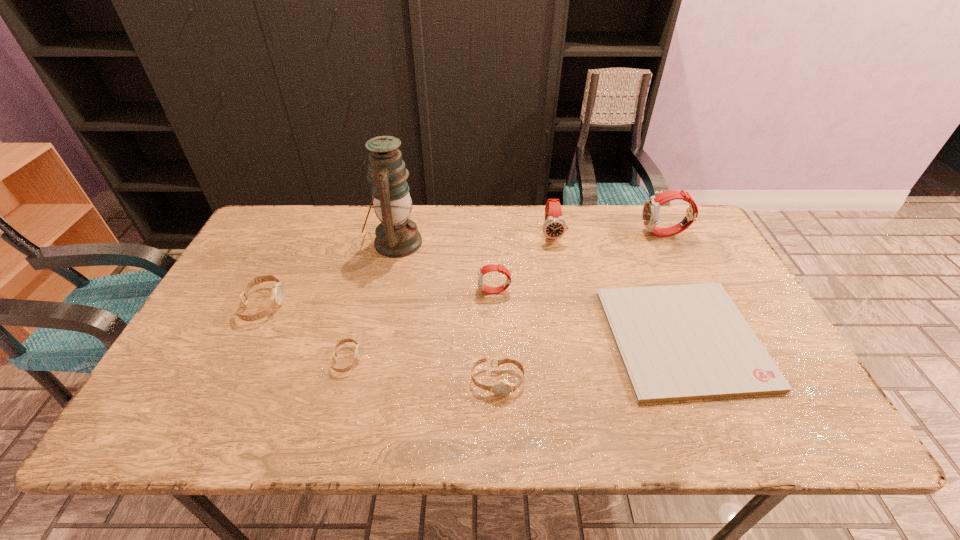
What are the coordinates of `vacant space located 0.100m on the face of the nearest red watch` in the screenshot? It's located at (442, 292).

At what (x,y) coordinates should I click in order to perform the action: click on vacant point located on the face of the nearest red watch. Please return your answer as a coordinate pair (x, y). Image resolution: width=960 pixels, height=540 pixels. Looking at the image, I should click on (413, 292).

Locate an element on the screen. vacant position located on the face of the nearest red watch is located at coordinates (384, 292).

What are the coordinates of `vacant area located 0.350m on the face of the third shortest watch` in the screenshot? It's located at (413, 305).

At what (x,y) coordinates should I click in order to perform the action: click on vacant point located on the face of the rightmost beige watch. Please return your answer as a coordinate pair (x, y). This screenshot has width=960, height=540. Looking at the image, I should click on (499, 439).

Locate an element on the screen. The width and height of the screenshot is (960, 540). vacant region located on the face of the second beige watch from left to right is located at coordinates (389, 360).

This screenshot has width=960, height=540. Identify the location of vacant position located 0.210m on the left of the shortest object. (524, 339).

You are a GUI agent. You are given a task and a screenshot of the screen. Output one action in this format:
    pyautogui.click(x=<x>, y=<y>)
    Task: Click on the oil lamp that is at the far edge
    Image resolution: width=960 pixels, height=540 pixels.
    Given the screenshot: What is the action you would take?
    pyautogui.click(x=397, y=236)

Where is `object located in the near edge section of the desktop`? Image resolution: width=960 pixels, height=540 pixels. object located in the near edge section of the desktop is located at coordinates (678, 342).

The image size is (960, 540). Identify the location of object that is at the left edge. (278, 291).